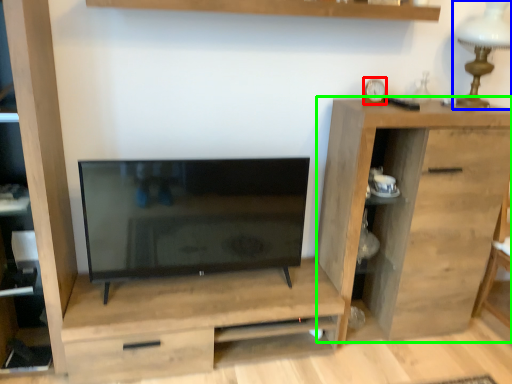
Question: Considering the real-world distances, which object is farthest from clock (highlighted by a red box)? table lamp (highlighted by a blue box) or chest of drawers (highlighted by a green box)?

Choices:
 (A) table lamp
 (B) chest of drawers

Answer: (B)